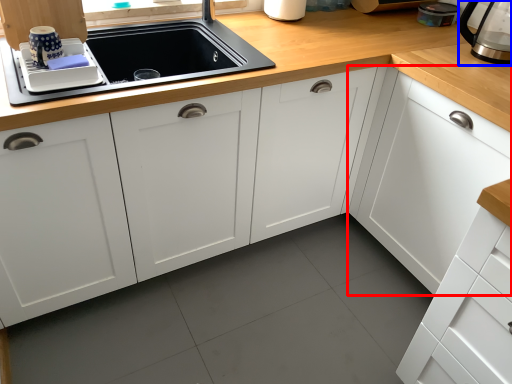
Question: Which of the following is the closest to the observer, cabinetry (highlighted by a red box) or coffeepot (highlighted by a blue box)?

Choices:
 (A) cabinetry
 (B) coffeepot

Answer: (A)